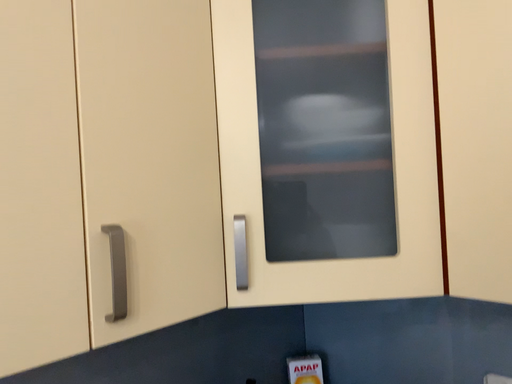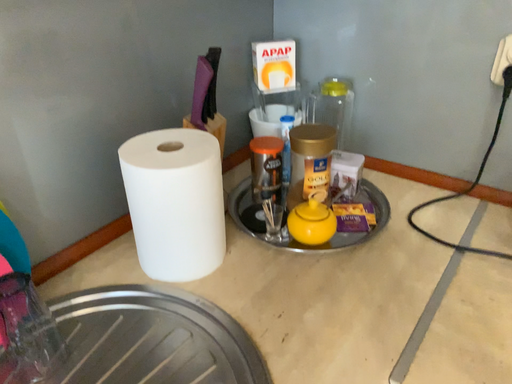
Question: Which way did the camera rotate in the video?

Choices:
 (A) rotated upward
 (B) rotated downward

Answer: (B)